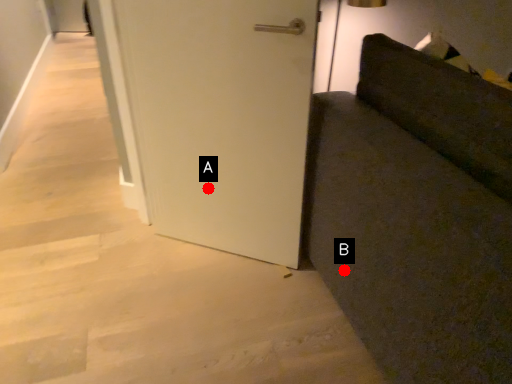
Question: Two points are circled on the image, labeled by A and B beside each circle. Which point is closer to the camera?

Choices:
 (A) A is closer
 (B) B is closer

Answer: (B)